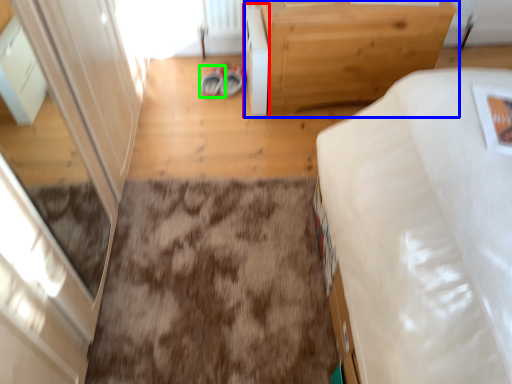
Question: Which object is positioned farthest from cabinetry (highlighted by a red box)? Select from table (highlighted by a blue box) and footwear (highlighted by a green box).

Choices:
 (A) table
 (B) footwear

Answer: (B)